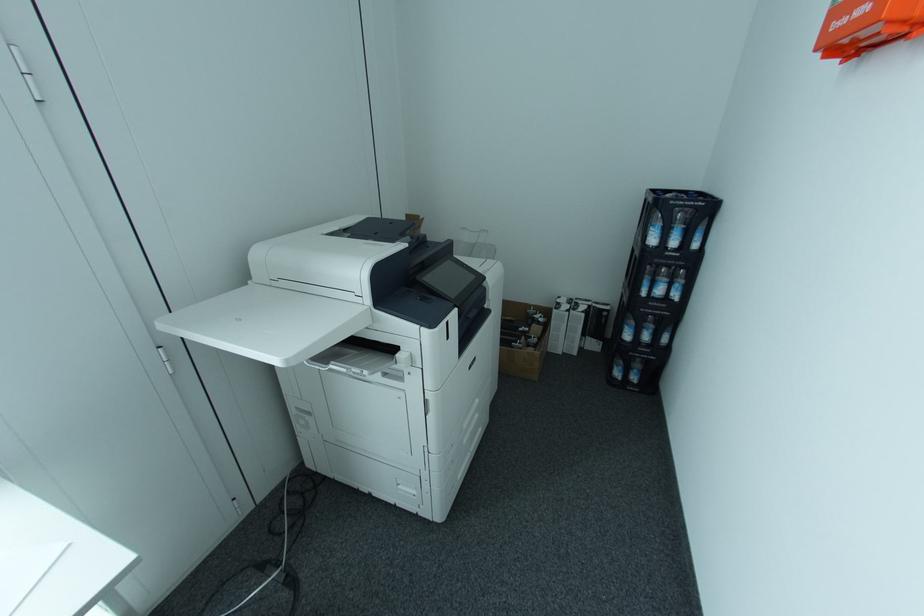
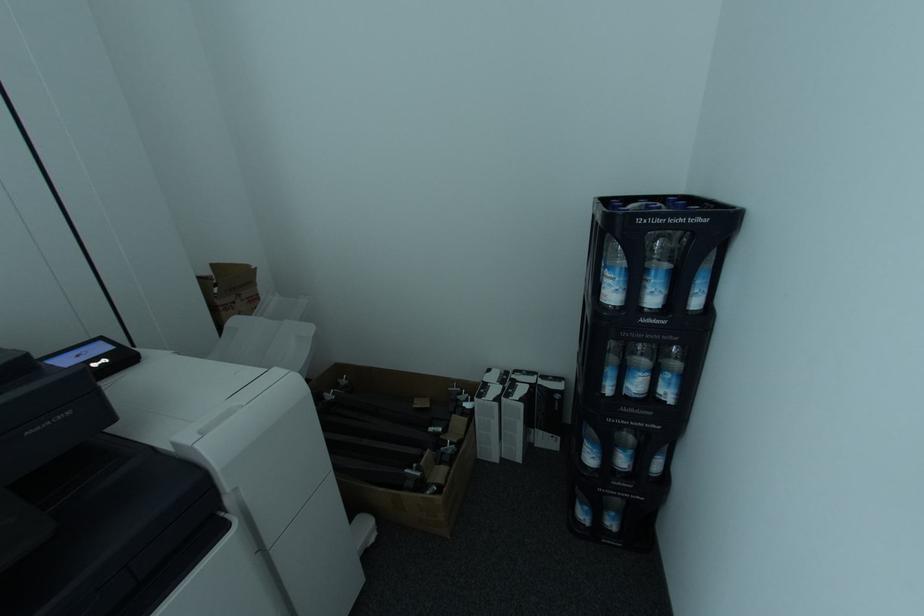
In a continuous first-person perspective shot, in which direction is the camera moving?

The cameraman walked toward right, forward.